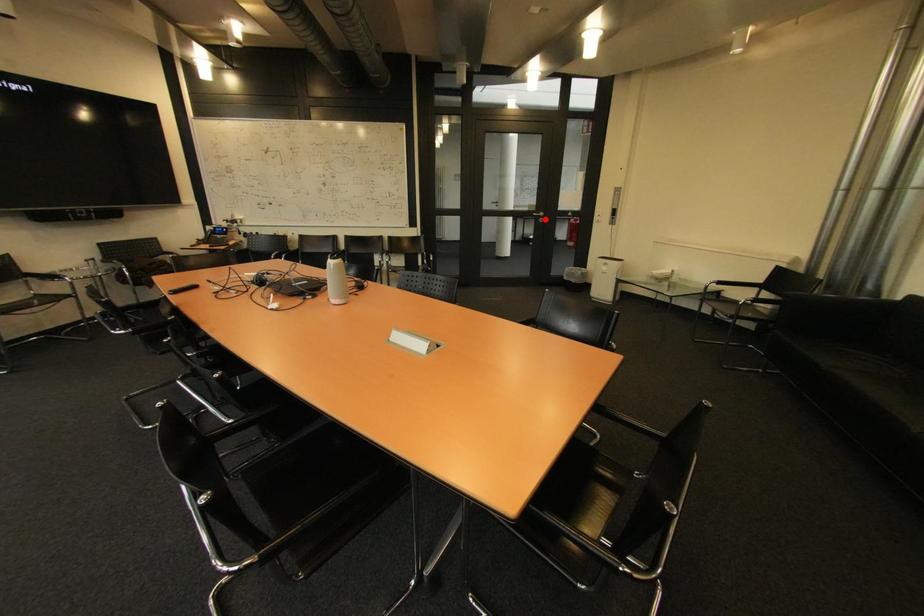
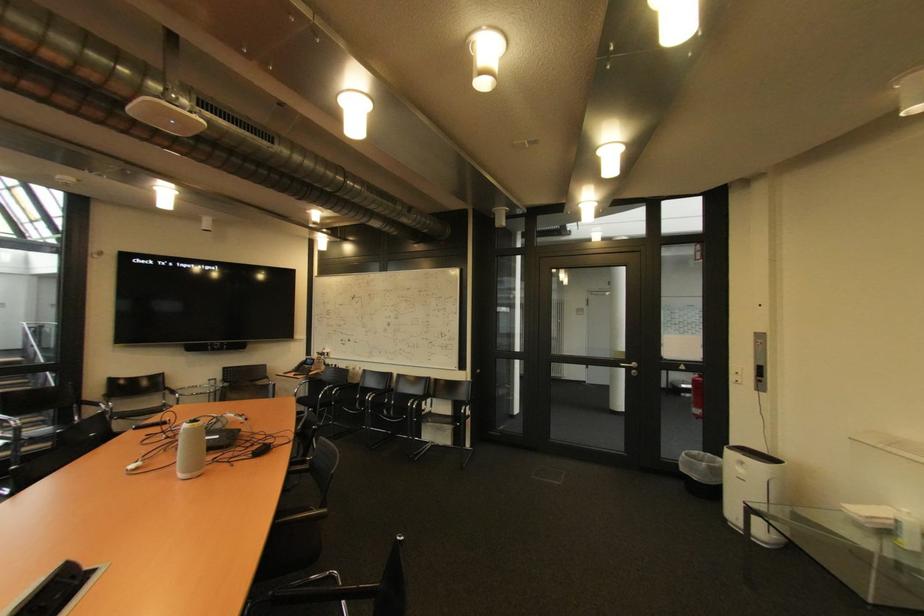
Question: I am providing you with two images of the same scene from different viewpoints. Image1 has a red point marked. In image2, the corresponding 3D location appears at what relative position? Reply with the corresponding letter.

Choices:
 (A) Closer
 (B) Farther

Answer: (B)